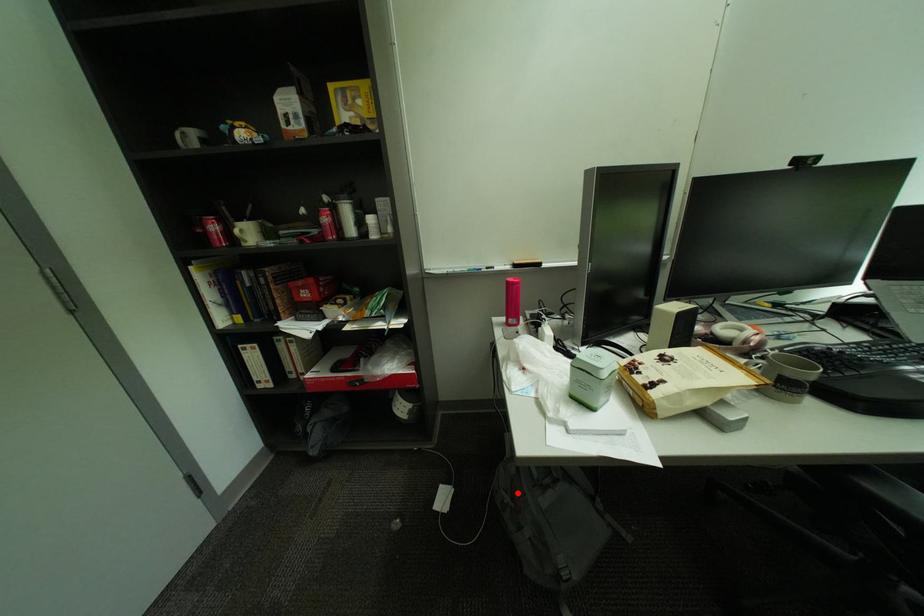
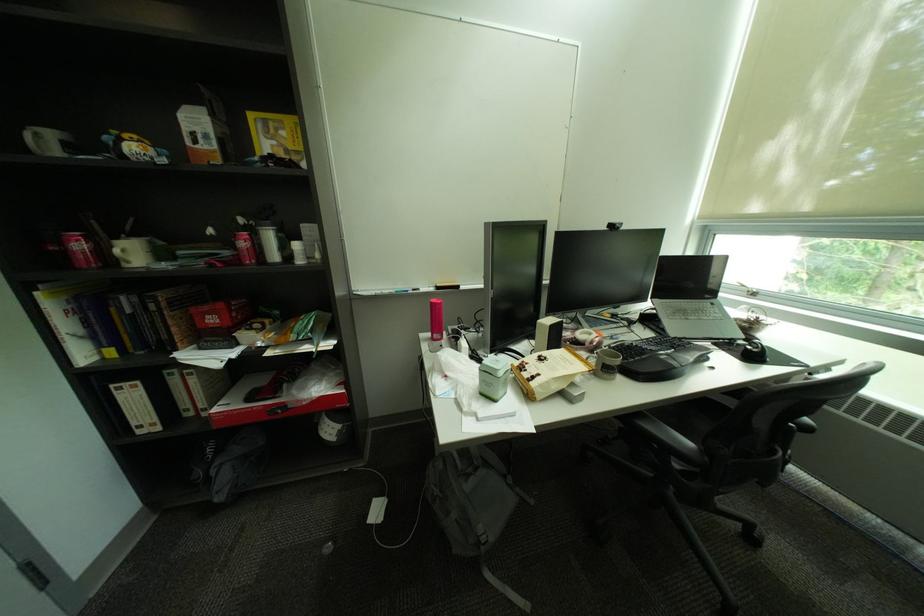
Find the pixel in the second image that matches the highlighted location in the first image.

(446, 487)